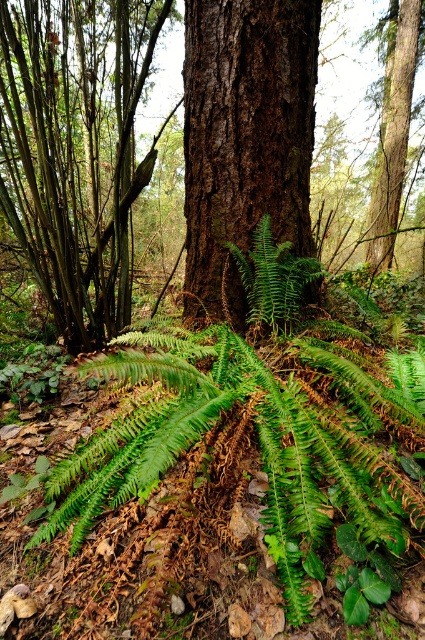
You are a hiker who wants to take a photo of the brown rough bark tree at center. However, there is a green leafy fern at lower center blocking the view. Can you move the fern to the side to get a clear shot of the tree?

The green leafy fern at lower center is in front of the brown rough bark tree at center, so moving it aside would allow you to see the tree without obstruction.